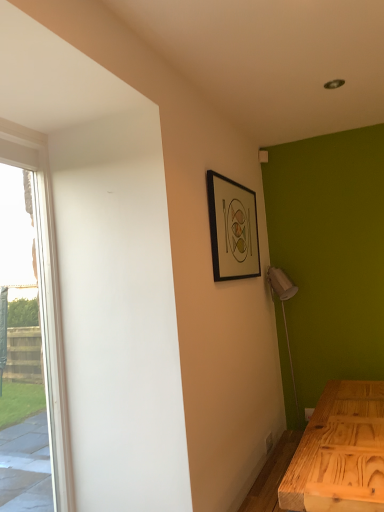
Question: From a real-world perspective, is black matte picture frame at upper right positioned above or below clear glass window at left?

Choices:
 (A) below
 (B) above

Answer: (B)

Question: Considering their positions, is black matte picture frame at upper right located in front of or behind clear glass window at left?

Choices:
 (A) behind
 (B) front

Answer: (A)

Question: Considering the positions of black matte picture frame at upper right and clear glass window at left in the image, is black matte picture frame at upper right bigger or smaller than clear glass window at left?

Choices:
 (A) small
 (B) big

Answer: (A)

Question: From the image's perspective, is clear glass window at left located above or below black matte picture frame at upper right?

Choices:
 (A) below
 (B) above

Answer: (A)

Question: In terms of width, does clear glass window at left look wider or thinner when compared to black matte picture frame at upper right?

Choices:
 (A) thin
 (B) wide

Answer: (B)

Question: Does point (54, 227) appear closer or farther from the camera than point (213, 242)?

Choices:
 (A) closer
 (B) farther

Answer: (A)

Question: Considering the positions of clear glass window at left and black matte picture frame at upper right in the image, is clear glass window at left taller or shorter than black matte picture frame at upper right?

Choices:
 (A) tall
 (B) short

Answer: (A)